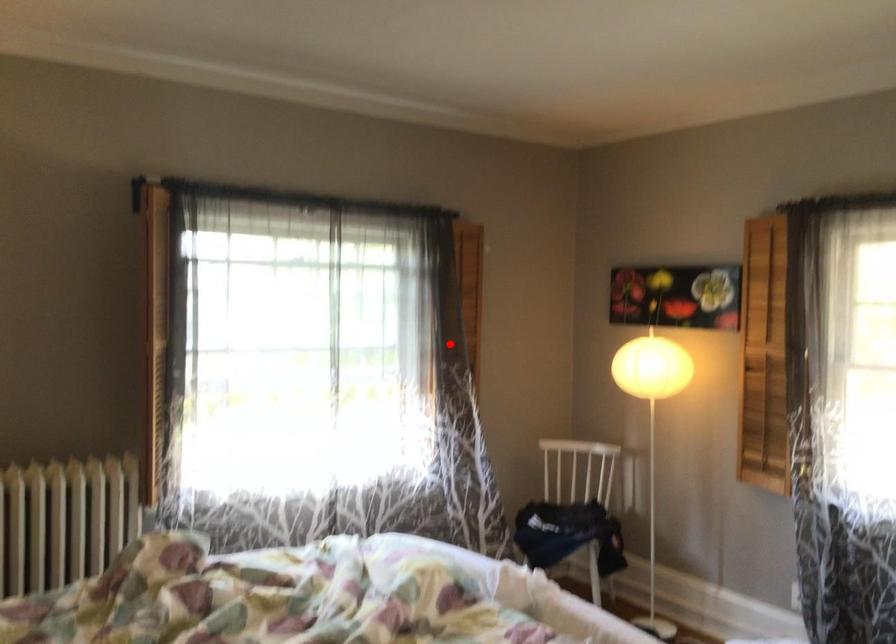
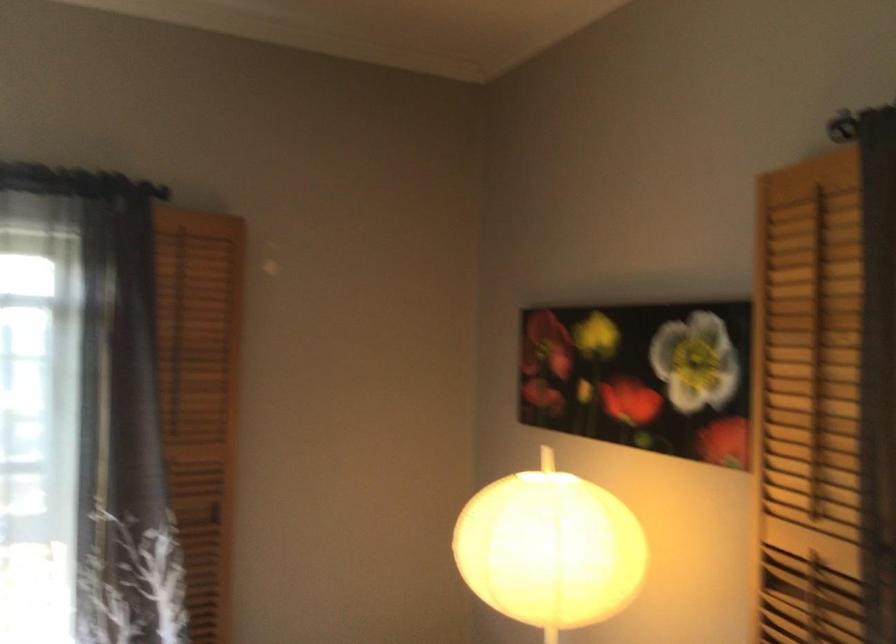
Find the pixel in the second image that matches the highlighted location in the first image.

(124, 487)